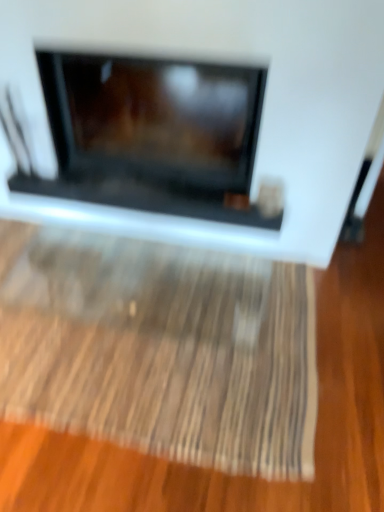
Question: From the image's perspective, is wooden textured mat at center above or below matte black fireplace at center?

Choices:
 (A) below
 (B) above

Answer: (A)

Question: In the image, is wooden textured mat at center on the left side or the right side of matte black fireplace at center?

Choices:
 (A) left
 (B) right

Answer: (A)

Question: Considering the positions of wooden textured mat at center and matte black fireplace at center in the image, is wooden textured mat at center taller or shorter than matte black fireplace at center?

Choices:
 (A) tall
 (B) short

Answer: (B)

Question: From a real-world perspective, is matte black fireplace at center positioned above or below wooden textured mat at center?

Choices:
 (A) below
 (B) above

Answer: (B)

Question: Is matte black fireplace at center in front of or behind wooden textured mat at center in the image?

Choices:
 (A) behind
 (B) front

Answer: (B)

Question: Is matte black fireplace at center inside the boundaries of wooden textured mat at center, or outside?

Choices:
 (A) inside
 (B) outside

Answer: (B)

Question: Would you say matte black fireplace at center is to the left or to the right of wooden textured mat at center in the picture?

Choices:
 (A) right
 (B) left

Answer: (A)